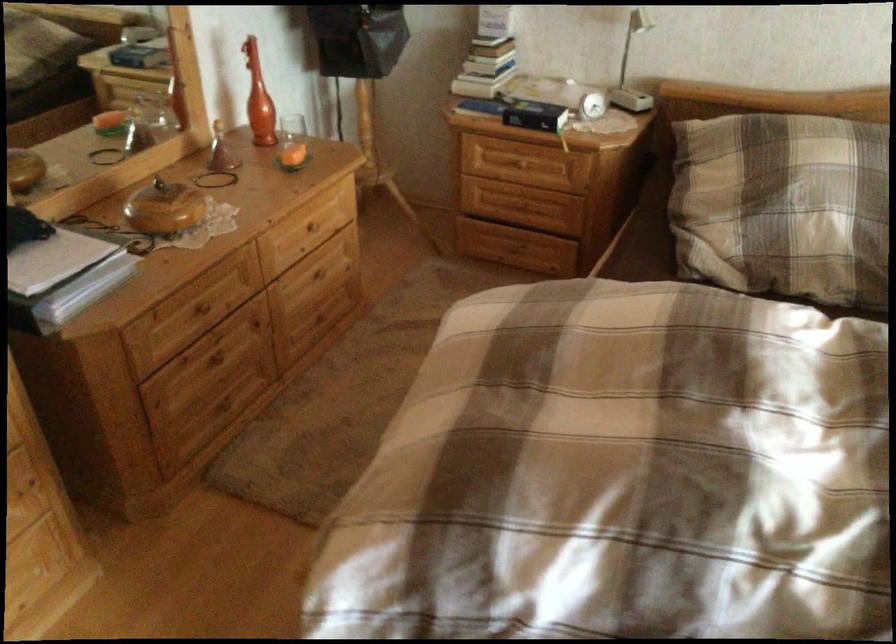
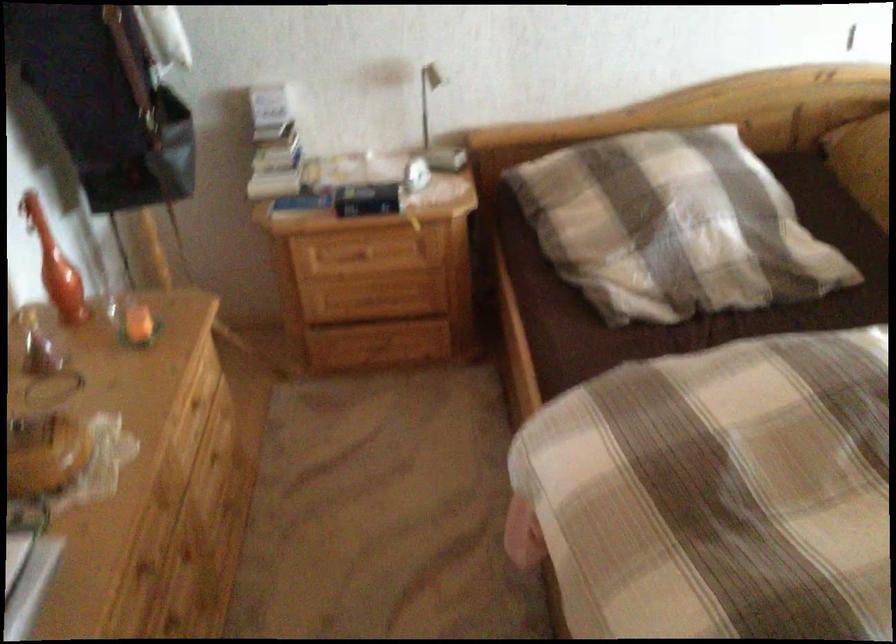
Locate, in the second image, the point that corresponds to pixel 319 220 in the first image.

(200, 395)